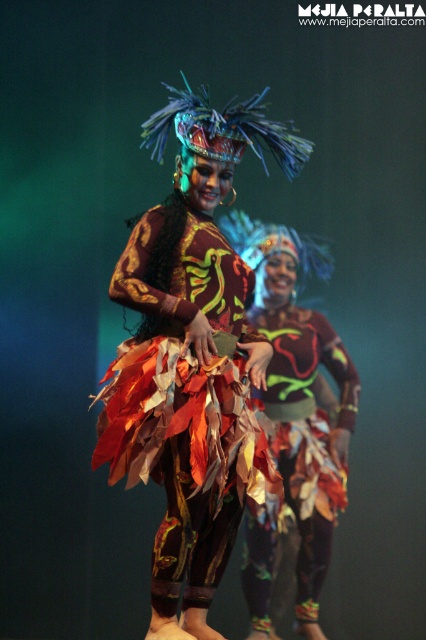
Does metallic leaf skirt at center have a greater height compared to leaves fabric skirt at center?

Incorrect, metallic leaf skirt at center's height is not larger of leaves fabric skirt at center's.

Can you confirm if metallic leaf skirt at center is positioned above leaves fabric skirt at center?

Yes.

Is point (212, 380) in front of point (307, 486)?

Yes, it is.

The image size is (426, 640). I want to click on metallic leaf skirt at center, so click(184, 403).